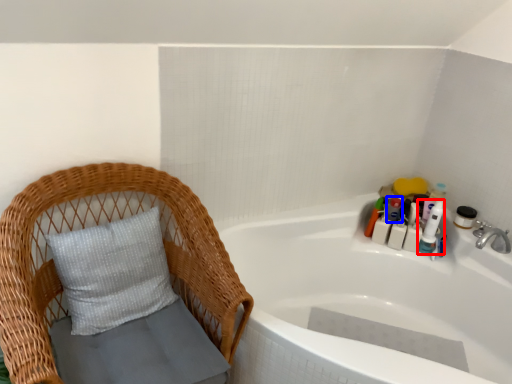
Question: Which object is further to the camera taking this photo, toiletry (highlighted by a red box) or toiletry (highlighted by a blue box)?

Choices:
 (A) toiletry
 (B) toiletry

Answer: (B)